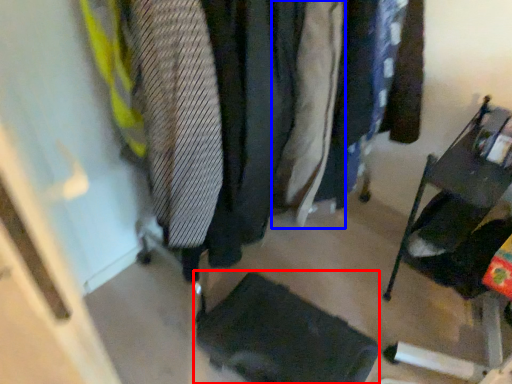
Question: Which object appears closest to the camera in this image, footrest (highlighted by a red box) or clothing (highlighted by a blue box)?

Choices:
 (A) footrest
 (B) clothing

Answer: (B)